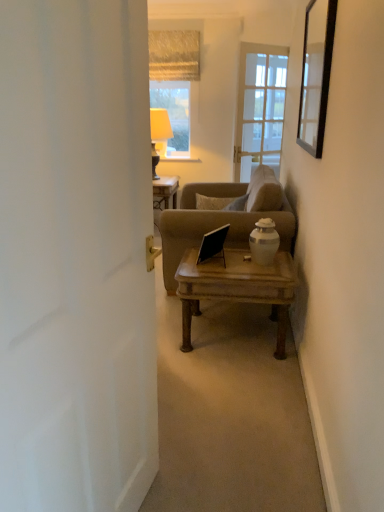
Where is `wooden coffee table at center`? Image resolution: width=384 pixels, height=512 pixels. wooden coffee table at center is located at coordinates (236, 287).

From the picture: Measure the distance between textured beige curtain at upper center and camera.

textured beige curtain at upper center and camera are 16.38 feet apart from each other.

What do you see at coordinates (158, 134) in the screenshot? The image size is (384, 512). I see `matte beige lampshade at upper center` at bounding box center [158, 134].

Identify the location of wooden coffee table at center. (236, 287).

Is point (25, 443) closer or farther from the camera than point (267, 267)?

Clearly, point (25, 443) is closer to the camera than point (267, 267).

From a real-world perspective, does white matte door at left sit lower than wooden coffee table at center?

No, from a real-world perspective, white matte door at left is not under wooden coffee table at center.

From the picture: Is white matte door at left not inside wooden coffee table at center?

That's correct, white matte door at left is outside of wooden coffee table at center.

Who is bigger, textured beige curtain at upper center or matte beige lampshade at upper center?

With larger size is matte beige lampshade at upper center.

What's the angular difference between textured beige curtain at upper center and matte beige lampshade at upper center's facing directions?

They differ by 0.548 degrees in their facing directions.

Is point (172, 65) less distant than point (152, 117)?

No.

Based on their positions, is textured beige curtain at upper center located to the left or right of matte beige lampshade at upper center?

textured beige curtain at upper center is positioned on matte beige lampshade at upper center's right side.

Is black matte laptop at center surrounded by matte beige lampshade at upper center?

No.

Locate an element on the screen. laptop lying on the right of matte beige lampshade at upper center is located at coordinates (212, 243).

Which is more to the left, matte beige lampshade at upper center or black matte laptop at center?

matte beige lampshade at upper center.

Does matte beige lampshade at upper center have a greater width compared to black matte laptop at center?

Indeed, matte beige lampshade at upper center has a greater width compared to black matte laptop at center.

Considering the relative positions of black matte laptop at center and wooden coffee table at center in the image provided, is black matte laptop at center behind wooden coffee table at center?

Yes, black matte laptop at center is further from the camera.

Does black matte laptop at center turn towards wooden coffee table at center?

No, black matte laptop at center is not facing towards wooden coffee table at center.

From the image's perspective, is textured beige curtain at upper center located beneath white matte door at left?

Actually, textured beige curtain at upper center appears above white matte door at left in the image.

Considering the relative positions of textured beige curtain at upper center and white matte door at left in the image provided, is textured beige curtain at upper center in front of white matte door at left?

No.

Is textured beige curtain at upper center thinner than white matte door at left?

Yes.

Consider the image. How many degrees apart are the facing directions of textured beige curtain at upper center and white matte door at left?

They differ by 77.3 degrees in their facing directions.

Which object is more forward, white matte door at left or matte beige lampshade at upper center?

Positioned in front is white matte door at left.

Is white matte door at left shorter than matte beige lampshade at upper center?

No.

In the image, is white matte door at left on the left side or the right side of matte beige lampshade at upper center?

From the image, it's evident that white matte door at left is to the right of matte beige lampshade at upper center.

Can you see matte beige lampshade at upper center touching wooden coffee table at center?

matte beige lampshade at upper center and wooden coffee table at center are not in contact.

From a real-world perspective, is matte beige lampshade at upper center located higher than wooden coffee table at center?

Yes.

Is matte beige lampshade at upper center situated inside wooden coffee table at center or outside?

matte beige lampshade at upper center is not inside wooden coffee table at center, it's outside.

Would you say matte beige lampshade at upper center is to the left or to the right of wooden coffee table at center in the picture?

Based on their positions, matte beige lampshade at upper center is located to the left of wooden coffee table at center.

Locate an element on the screen. Image resolution: width=384 pixels, height=512 pixels. door positioned vertically above the wooden coffee table at center (from a real-world perspective) is located at coordinates (76, 257).

In the image, there is a textured beige curtain at upper center. At what (x,y) coordinates should I click in order to perform the action: click on lamp below it (from the image's perspective). Please return your answer as a coordinate pair (x, y). This screenshot has height=512, width=384. Looking at the image, I should click on (158, 134).

When comparing their distances from white matte door at left, does textured beige curtain at upper center or black glass mirror at upper right seem further?

textured beige curtain at upper center.

Which object lies further to the anchor point textured beige curtain at upper center, matte beige lampshade at upper center or white matte door at left?

white matte door at left.

In the scene shown: Based on their spatial positions, is matte beige lampshade at upper center or white matte door at left further from black matte laptop at center?

Based on the image, matte beige lampshade at upper center appears to be further to black matte laptop at center.

When comparing their distances from black matte laptop at center, does black glass mirror at upper right or textured beige curtain at upper center seem further?

Based on the image, textured beige curtain at upper center appears to be further to black matte laptop at center.

Based on their spatial positions, is black matte laptop at center or textured beige curtain at upper center further from matte beige lampshade at upper center?

Based on the image, black matte laptop at center appears to be further to matte beige lampshade at upper center.

Looking at the image, which one is located further to black glass mirror at upper right, black matte laptop at center or textured beige curtain at upper center?

textured beige curtain at upper center is further to black glass mirror at upper right.

From the picture: Which object lies nearer to the anchor point black glass mirror at upper right, wooden coffee table at center or matte beige lampshade at upper center?

wooden coffee table at center is positioned closer to the anchor black glass mirror at upper right.

Considering their positions, is black glass mirror at upper right positioned further to matte beige lampshade at upper center than textured beige curtain at upper center?

Among the two, black glass mirror at upper right is located further to matte beige lampshade at upper center.

Where is `coffee table positioned between white matte door at left and textured beige curtain at upper center from near to far`? This screenshot has width=384, height=512. coffee table positioned between white matte door at left and textured beige curtain at upper center from near to far is located at coordinates (236, 287).

Locate an element on the screen. The height and width of the screenshot is (512, 384). laptop that lies between textured beige curtain at upper center and wooden coffee table at center from top to bottom is located at coordinates (212, 243).

The image size is (384, 512). Find the location of `coffee table positioned between black glass mirror at upper right and matte beige lampshade at upper center from near to far`. coffee table positioned between black glass mirror at upper right and matte beige lampshade at upper center from near to far is located at coordinates (236, 287).

At what (x,y) coordinates should I click in order to perform the action: click on lamp between white matte door at left and textured beige curtain at upper center in the front-back direction. Please return your answer as a coordinate pair (x, y). Looking at the image, I should click on (158, 134).